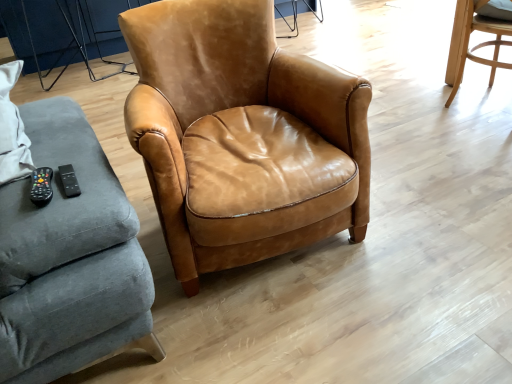
Question: Does light brown leather chair at upper right, the 2th chair when ordered from left to right, have a smaller size compared to cognac leather armchair at center, acting as the first chair starting from the left?

Choices:
 (A) no
 (B) yes

Answer: (B)

Question: Is light brown leather chair at upper right, which appears as the 1th chair when viewed from the right, outside of cognac leather armchair at center, acting as the first chair starting from the left?

Choices:
 (A) no
 (B) yes

Answer: (B)

Question: Does light brown leather chair at upper right, the 2th chair when ordered from left to right, appear on the left side of cognac leather armchair at center, the 2th chair when ordered from right to left?

Choices:
 (A) no
 (B) yes

Answer: (A)

Question: Could you tell me if light brown leather chair at upper right, which appears as the 1th chair when viewed from the right, is facing cognac leather armchair at center, the 2th chair when ordered from right to left?

Choices:
 (A) yes
 (B) no

Answer: (B)

Question: Considering the relative positions of light brown leather chair at upper right, the 2th chair when ordered from left to right, and cognac leather armchair at center, the 2th chair when ordered from right to left, in the image provided, is light brown leather chair at upper right, the 2th chair when ordered from left to right, in front of cognac leather armchair at center, the 2th chair when ordered from right to left,?

Choices:
 (A) no
 (B) yes

Answer: (A)

Question: From a real-world perspective, does light brown leather chair at upper right, the 2th chair when ordered from left to right, sit lower than cognac leather armchair at center, acting as the first chair starting from the left?

Choices:
 (A) no
 (B) yes

Answer: (B)

Question: From the image's perspective, is cognac leather armchair at center, the 2th chair when ordered from right to left, under light brown leather chair at upper right, the 2th chair when ordered from left to right?

Choices:
 (A) no
 (B) yes

Answer: (B)

Question: From the image's perspective, is cognac leather armchair at center, the 2th chair when ordered from right to left, on light brown leather chair at upper right, which appears as the 1th chair when viewed from the right?

Choices:
 (A) yes
 (B) no

Answer: (B)

Question: Can you see cognac leather armchair at center, the 2th chair when ordered from right to left, touching light brown leather chair at upper right, which appears as the 1th chair when viewed from the right?

Choices:
 (A) yes
 (B) no

Answer: (B)

Question: Is cognac leather armchair at center, acting as the first chair starting from the left, oriented away from light brown leather chair at upper right, the 2th chair when ordered from left to right?

Choices:
 (A) yes
 (B) no

Answer: (B)

Question: Is cognac leather armchair at center, acting as the first chair starting from the left, to the right of light brown leather chair at upper right, which appears as the 1th chair when viewed from the right, from the viewer's perspective?

Choices:
 (A) yes
 (B) no

Answer: (B)

Question: From a real-world perspective, is cognac leather armchair at center, the 2th chair when ordered from right to left, below light brown leather chair at upper right, the 2th chair when ordered from left to right?

Choices:
 (A) yes
 (B) no

Answer: (B)

Question: In terms of width, does cognac leather armchair at center, acting as the first chair starting from the left, look wider or thinner when compared to light brown leather chair at upper right, which appears as the 1th chair when viewed from the right?

Choices:
 (A) wide
 (B) thin

Answer: (A)